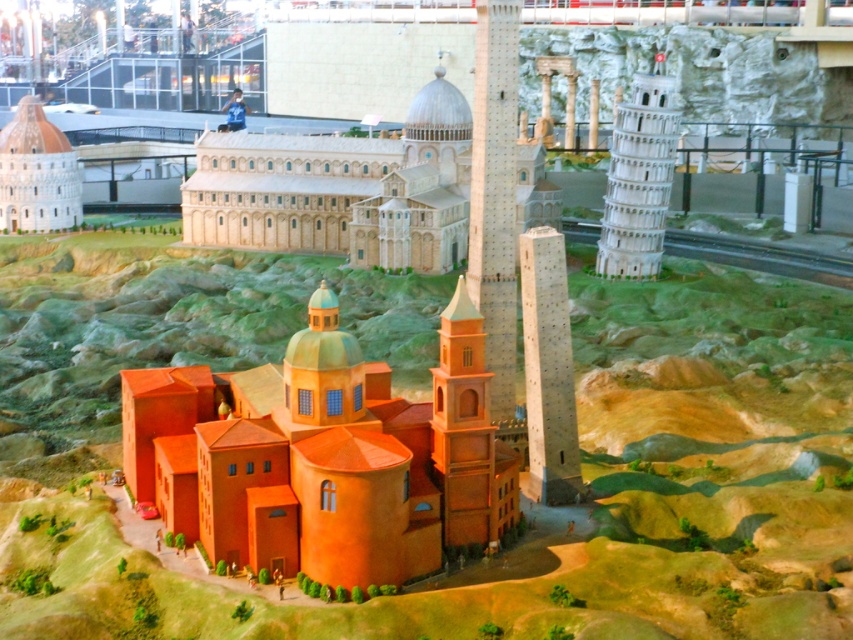
Does orange clay church at center appear over light brown stone church at center?

No, orange clay church at center is not above light brown stone church at center.

Find the location of a particular element. This screenshot has width=853, height=640. orange clay church at center is located at coordinates (323, 456).

This screenshot has height=640, width=853. I want to click on orange clay church at center, so click(x=323, y=456).

Which is behind, point (160, 609) or point (44, 221)?

Point (44, 221)

Consider the image. Between orange clay terrain at center and matte white dome at upper left, which one appears on the right side from the viewer's perspective?

orange clay terrain at center is more to the right.

Does point (49, 310) come in front of point (36, 161)?

That is True.

Identify the location of orange clay terrain at center. The image size is (853, 640). (592, 490).

Does point (283, 529) lie behind point (498, 170)?

No.

Between orange clay church at center and smooth stone tower at center, which one has more height?

With more height is smooth stone tower at center.

I want to click on orange clay church at center, so click(x=323, y=456).